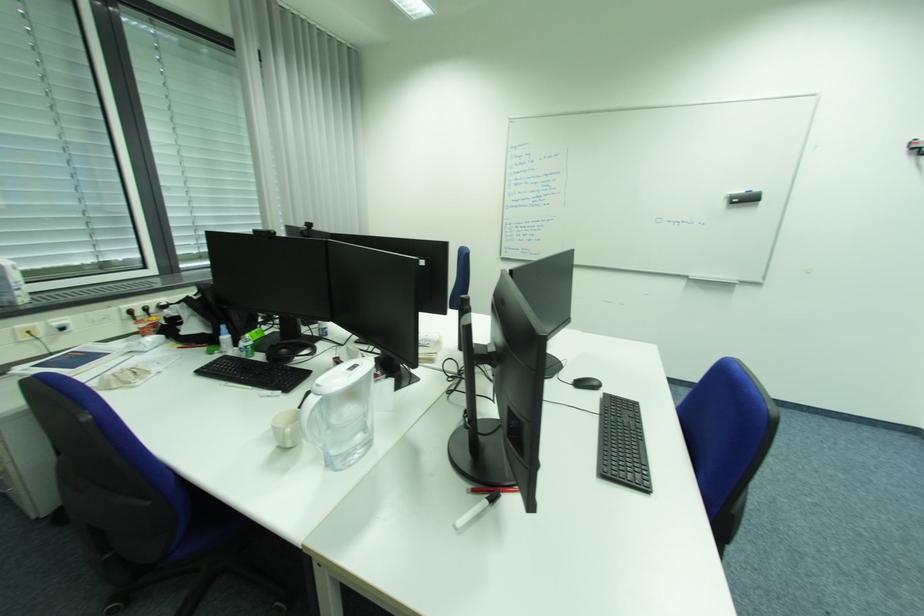
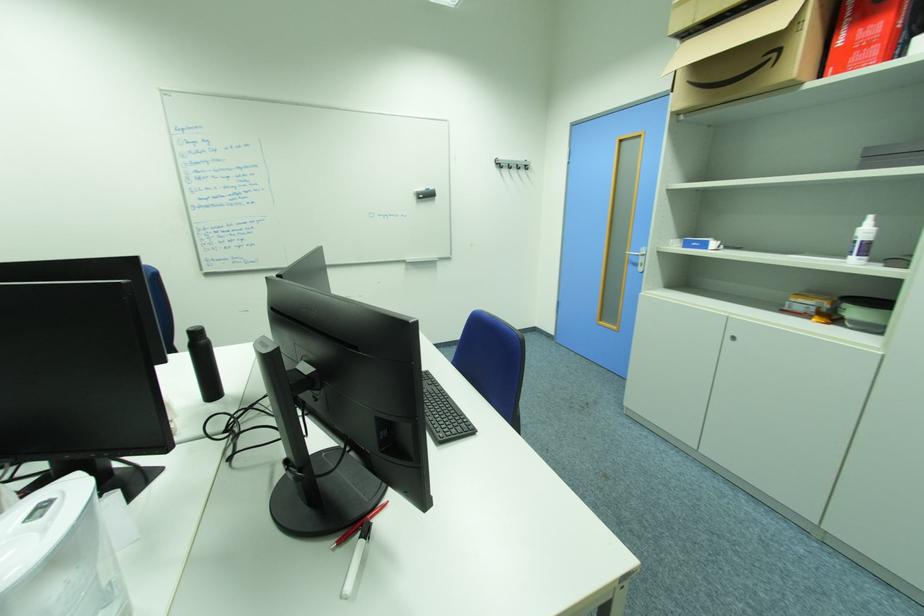
Question: How did the camera likely rotate?

Choices:
 (A) Left
 (B) Right
 (C) Up
 (D) Down

Answer: (B)